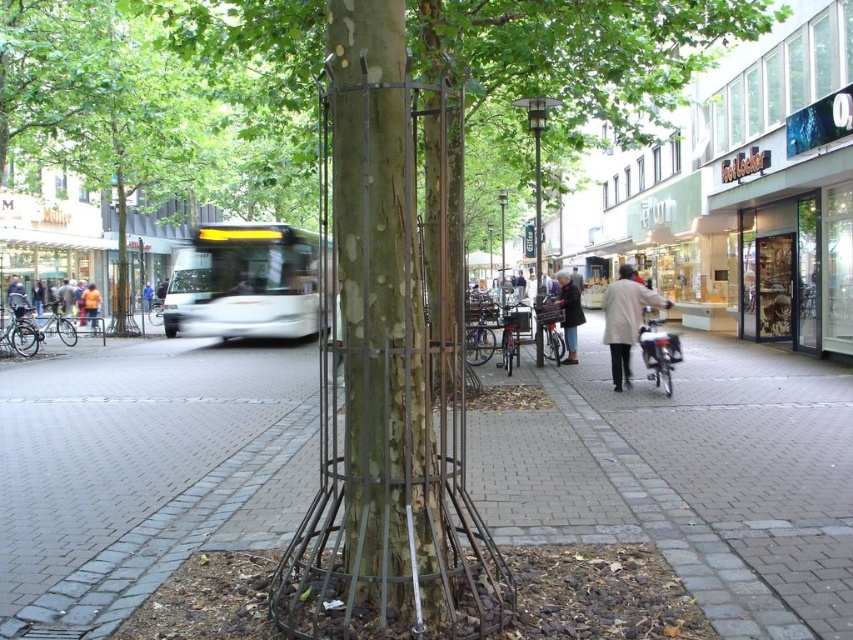
Based on the photo, you are standing at the location marked by the point at coordinates (688, 476). What type of surface are you currently standing on?

You are standing on brick pavement at center, as indicated by the point at coordinates (688, 476).

You are a delivery person who needs to place a large package on the ground. You see the metallic wire cage at center and the orange jacket at center. Which object should you choose to place the package next to so it takes up less space?

You should place the package next to the metallic wire cage at center because it occupies less space than the orange jacket at center.